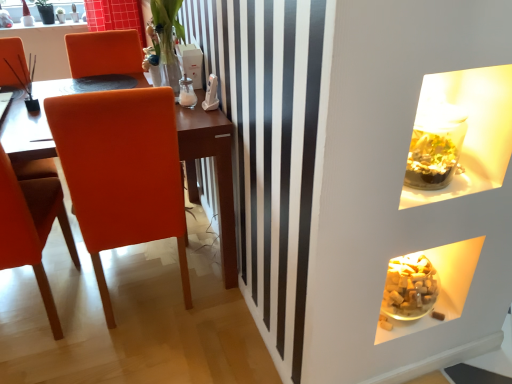
Question: Considering the positions of translucent glass cubes at lower right, which is the 1th food from left to right, and matte orange chair at left, which is the second chair in right-to-left order, in the image, is translucent glass cubes at lower right, which is the 1th food from left to right, bigger or smaller than matte orange chair at left, which is the second chair in right-to-left order,?

Choices:
 (A) big
 (B) small

Answer: (B)

Question: Is translucent glass cubes at lower right, which is the 1th food from left to right, taller or shorter than matte orange chair at left, which is the second chair in right-to-left order?

Choices:
 (A) short
 (B) tall

Answer: (A)

Question: Which is farther from the matte orange chair at left, which is the first chair from left to right?

Choices:
 (A) orange leather chair at left, arranged as the 1th chair when viewed from the right
 (B) translucent glass cubes at lower right, which appears as the 2th food when viewed from the right
 (C) translucent glass vase at upper center
 (D) brown sugar cubes at lower right, the second food in the left-to-right sequence

Answer: (D)

Question: Estimate the real-world distances between objects in this image. Which object is farther from the orange leather chair at left, which is counted as the second chair, starting from the left?

Choices:
 (A) translucent glass vase at upper center
 (B) translucent glass cubes at lower right, which is the 1th food from left to right
 (C) matte orange chair at left, which is the second chair in right-to-left order
 (D) brown sugar cubes at lower right, the second food in the left-to-right sequence

Answer: (D)